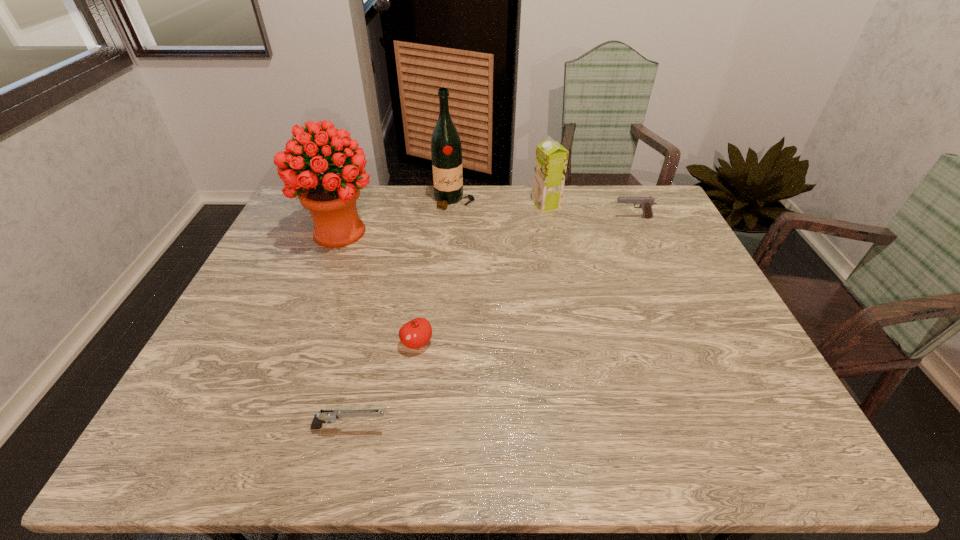
Identify the location of free spot that satisfies the following two spatial constraints: 1. on the front side of the second object from right to left; 2. on the left side of the wine bottle. This screenshot has height=540, width=960. (454, 205).

Find the location of a particular element. The width and height of the screenshot is (960, 540). vacant space that satisfies the following two spatial constraints: 1. on the front side of the wine bottle; 2. on the front-facing side of the shortest object is located at coordinates (436, 428).

Locate an element on the screen. The width and height of the screenshot is (960, 540). vacant space that satisfies the following two spatial constraints: 1. at the barrel of the right pistol; 2. on the front side of the second nearest object is located at coordinates (689, 343).